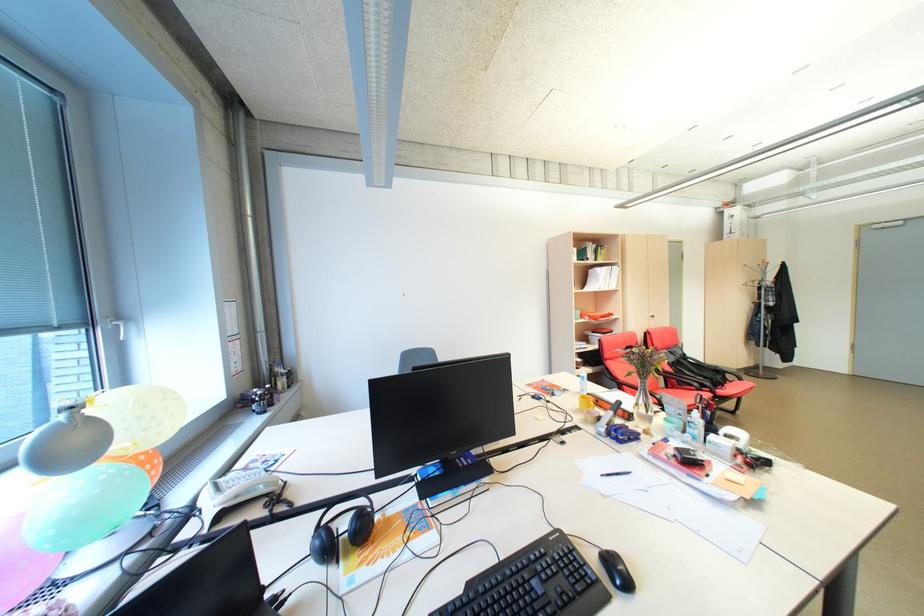
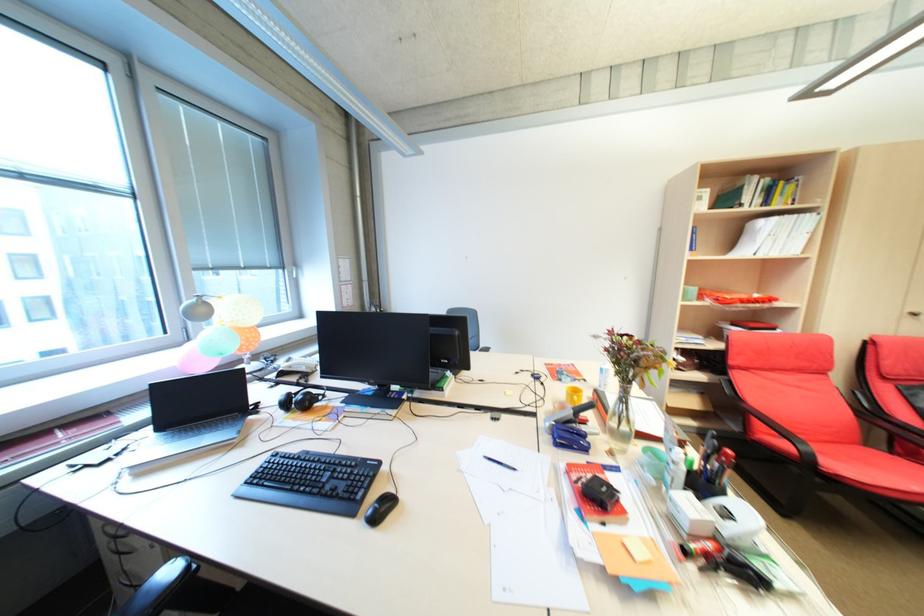
Where in the second image is the point corresponding to (629,442) from the first image?

(565, 445)